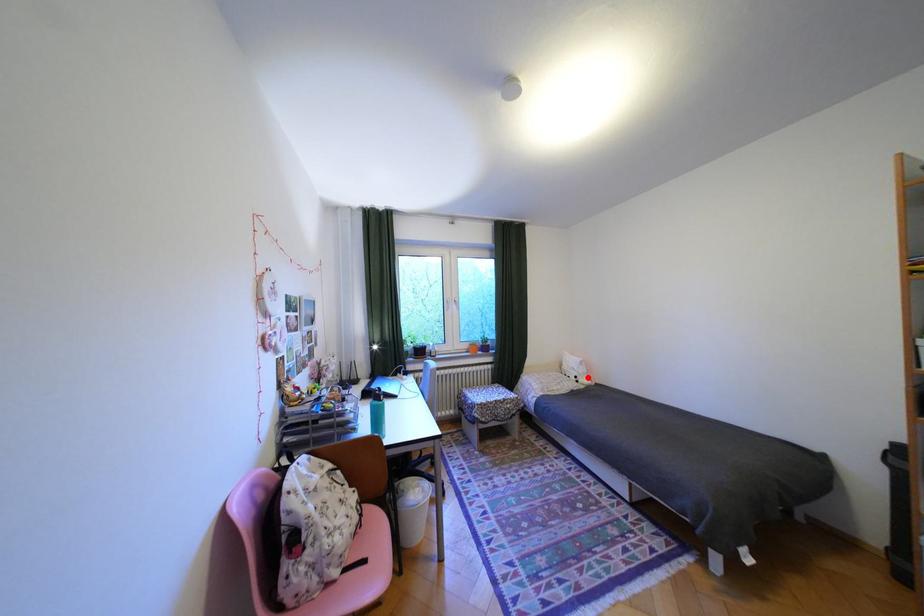
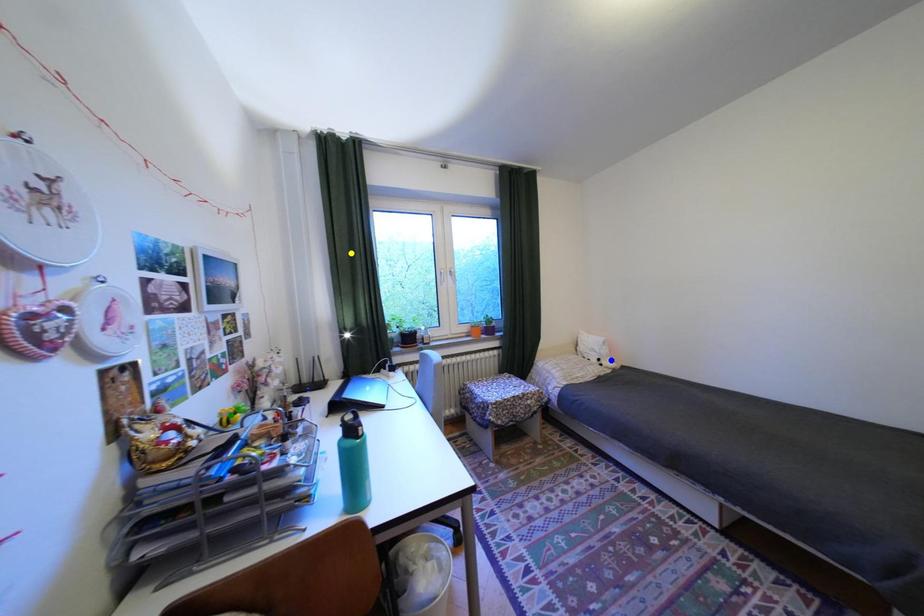
Question: I am providing you with two images of the same scene from different viewpoints. A red point is marked on the first image. You are given multiple points on the second image. Which spot in image 2 lines up with the point in image 1?

Choices:
 (A) yellow point
 (B) blue point
 (C) green point

Answer: (B)